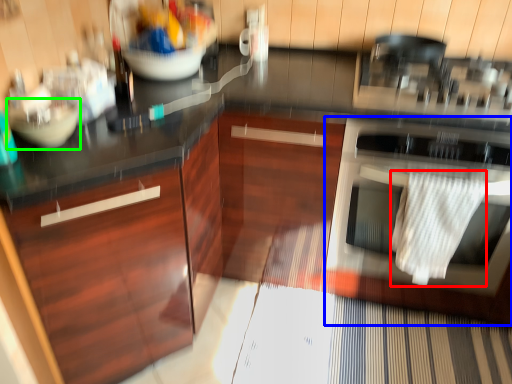
Question: Estimate the real-world distances between objects in this image. Which object is closer to material (highlighted by a red box), home appliance (highlighted by a blue box) or mixing bowl (highlighted by a green box)?

Choices:
 (A) home appliance
 (B) mixing bowl

Answer: (A)